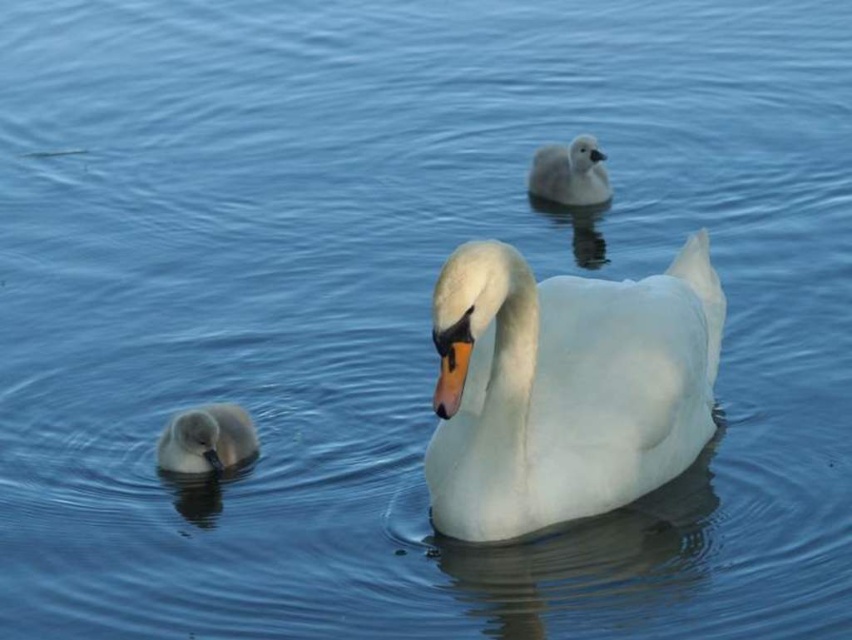
You are a bird watcher observing the scene. You notice the white glossy swan at center and the soft gray duckling at lower left. Which one is positioned higher in the image?

The white glossy swan at center is positioned higher than the soft gray duckling at lower left.

You are a photographer trying to capture a clear photo of the white glossy swan at center and the white fluffy duckling at upper center. Since both are white, you want to adjust your camera settings to highlight their size difference. Based on their positions, which one should you focus on to emphasize the size difference?

The white glossy swan at center has a greater height compared to the white fluffy duckling at upper center, so focusing on the white glossy swan at center will emphasize its larger size relative to the duckling.

Looking at this image, you are a birdwatcher observing the scene. You notice the soft gray duckling at lower left and the white fluffy duckling at upper center. Which duckling is wider?

The white fluffy duckling at upper center is wider than the soft gray duckling at lower left.